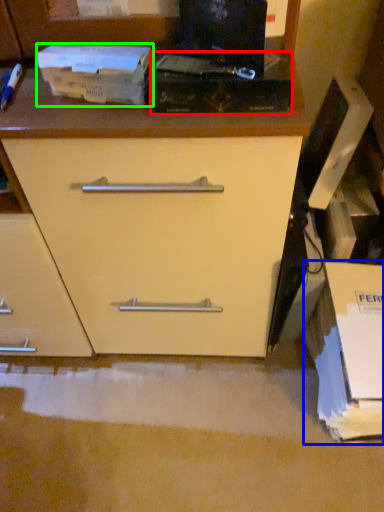
Question: Considering the real-world distances, which object is farthest from paperback book (highlighted by a red box)? cardboard box (highlighted by a blue box) or paperback book (highlighted by a green box)?

Choices:
 (A) cardboard box
 (B) paperback book

Answer: (A)